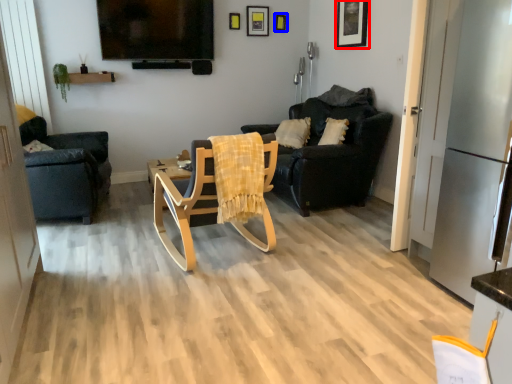
Question: Which point is further to the camera, picture frame (highlighted by a red box) or picture frame (highlighted by a blue box)?

Choices:
 (A) picture frame
 (B) picture frame

Answer: (B)